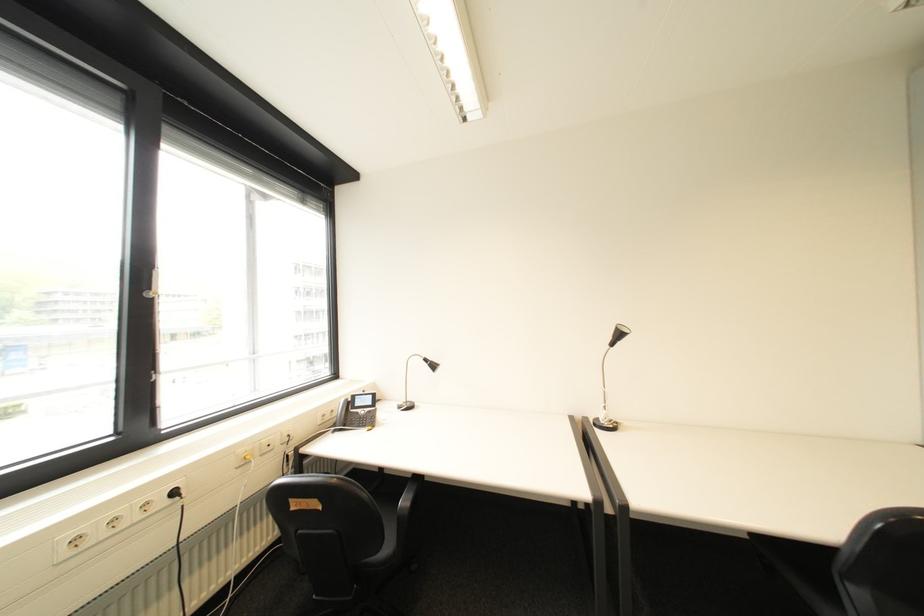
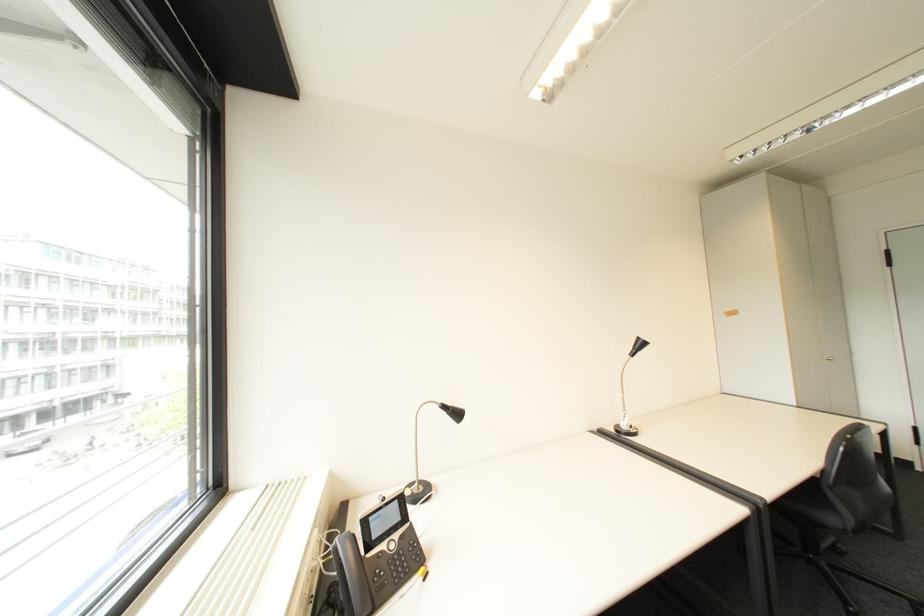
Locate, in the second image, the point that corresponds to (x=435, y=361) in the first image.

(455, 407)